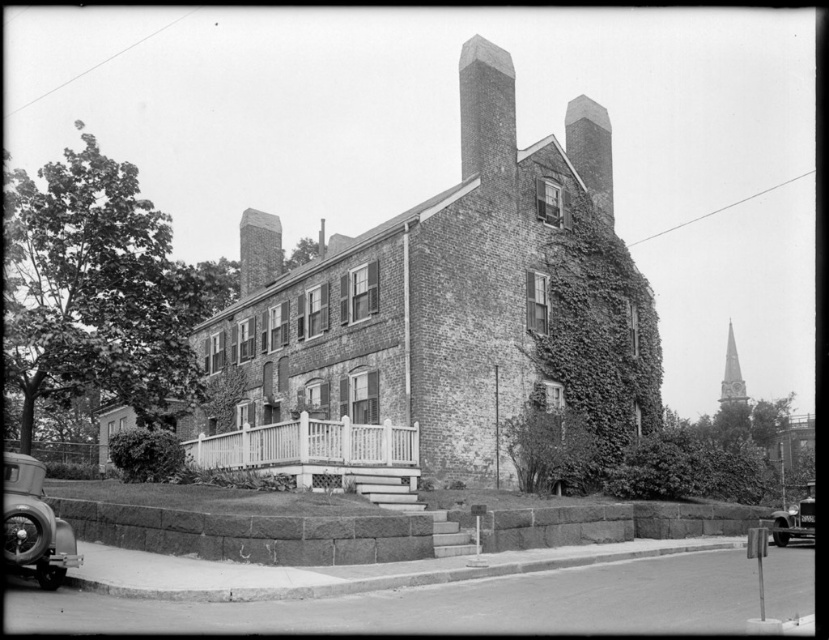
Based on the photo, is green ivy at lower left below dark gray stone chimney at upper center?

Indeed, green ivy at lower left is positioned under dark gray stone chimney at upper center.

Looking at this image, measure the distance between point (166, 284) and camera.

Point (166, 284) is 64.39 meters from camera.

Identify the location of green ivy at lower left. (97, 292).

Describe the element at coordinates (34, 524) in the screenshot. I see `shiny chrome car at lower left` at that location.

Who is higher up, shiny chrome car at lower left or smooth gray stone spire at upper right?

smooth gray stone spire at upper right is above.

Who is more forward, (18, 516) or (733, 392)?

Positioned in front is point (18, 516).

You are a GUI agent. You are given a task and a screenshot of the screen. Output one action in this format:
    pyautogui.click(x=<x>, y=<y>)
    Task: Click on the shiny chrome car at lower left
    The image size is (829, 640).
    Given the screenshot: What is the action you would take?
    pyautogui.click(x=34, y=524)

Which is more to the right, green ivy at lower left or smooth stone chimney at upper center?

smooth stone chimney at upper center

Does point (91, 140) come farther from viewer compared to point (485, 164)?

No, it is not.

Which is behind, point (221, 284) or point (482, 136)?

The point (221, 284) is more distant.

Image resolution: width=829 pixels, height=640 pixels. I want to click on green ivy at lower left, so [97, 292].